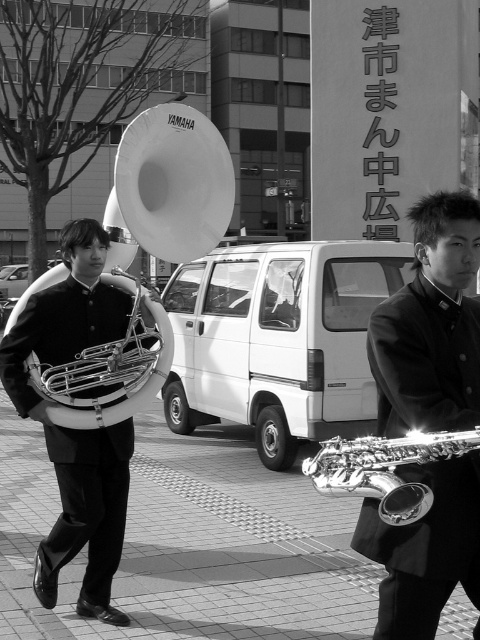
Which of these two, shiny silver saxophone at center or white plastic trumpet at center, stands taller?

With more height is shiny silver saxophone at center.

Is point (434, 556) positioned after point (199, 120)?

No, it is not.

Is point (459, 257) positioned before point (45, 362)?

Yes.

This screenshot has width=480, height=640. I want to click on shiny silver saxophone at center, so click(431, 324).

Describe the element at coordinates (192, 544) in the screenshot. I see `brick pavement at center` at that location.

Can you confirm if brick pavement at center is positioned below shiny brass tuba at left?

Yes.

Which is behind, point (248, 621) or point (95, 502)?

The point (248, 621) is more distant.

Find the location of `brick pavement at center`. brick pavement at center is located at coordinates (192, 544).

In the scene shown: Which is more to the left, shiny silver saxophone at center or shiny silver trumpet at center?

shiny silver trumpet at center is more to the left.

Between point (359, 525) and point (419, 515), which one is positioned in front?

Point (419, 515)

Who is more distant from viewer, (457, 237) or (332, 451)?

Positioned behind is point (457, 237).

Find the location of a particular element. The image size is (480, 640). shiny silver saxophone at center is located at coordinates [431, 324].